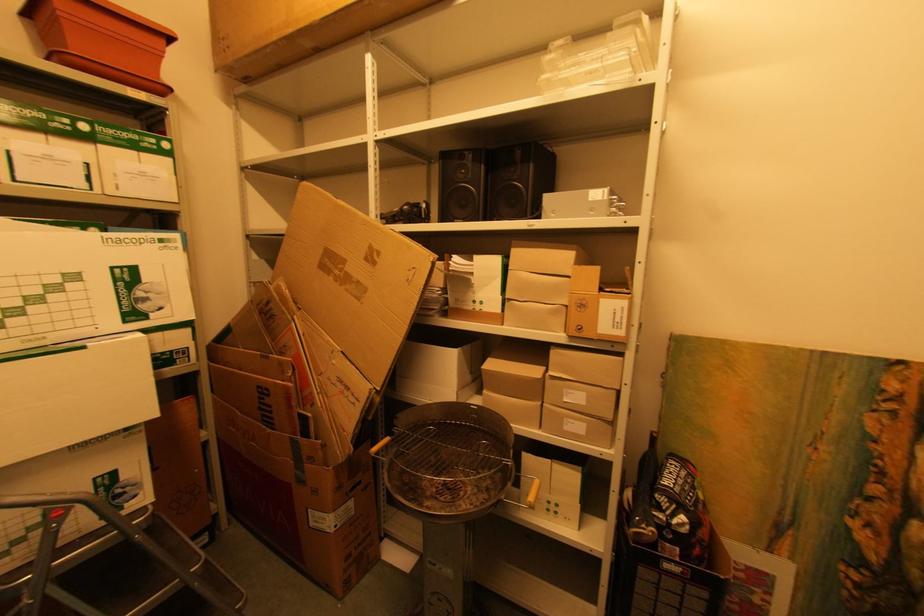
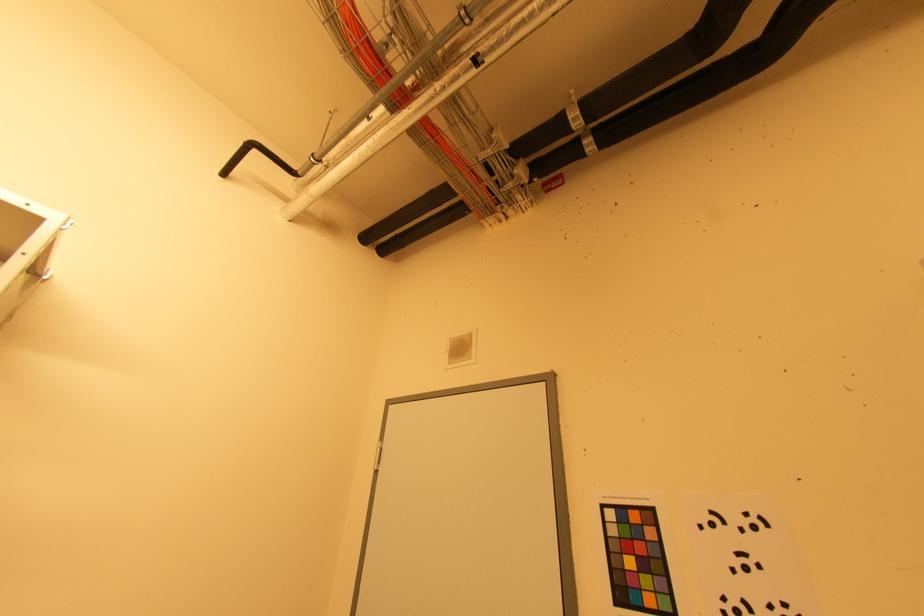
The images are taken continuously from a first-person perspective. In which direction is your viewpoint rotating?

The camera's rotation is toward right-up.